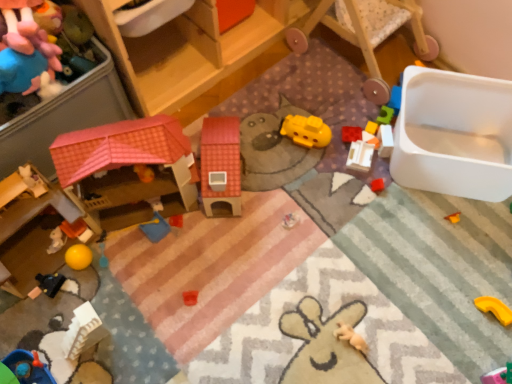
Where is `free space between light brown plush toy at lower right, the sixth toy from the right, and matte plastic dollhouse at center-left, acting as the eighth toy starting from the right`? free space between light brown plush toy at lower right, the sixth toy from the right, and matte plastic dollhouse at center-left, acting as the eighth toy starting from the right is located at coordinates (246, 260).